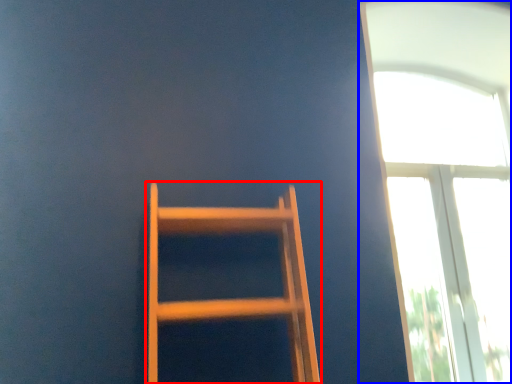
Question: Which point is closer to the camera, furniture (highlighted by a red box) or window (highlighted by a blue box)?

Choices:
 (A) furniture
 (B) window

Answer: (A)